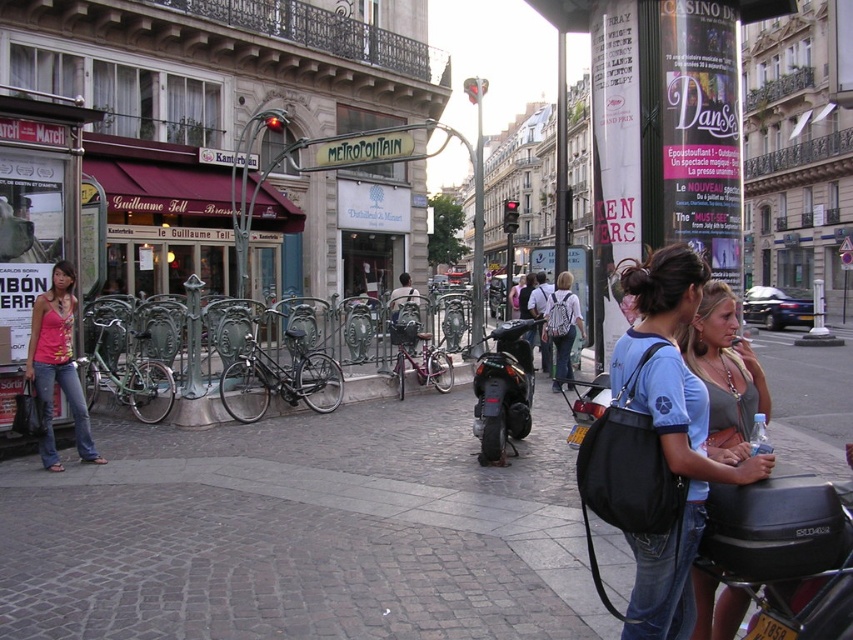
Question: Which is farther from the white backpack at center?

Choices:
 (A) cobblestone pavement at center
 (B) green matte bicycle at left

Answer: (B)

Question: Which is farther from the matte blue shirt at center?

Choices:
 (A) white backpack at center
 (B) denim jeans at lower left
 (C) brushed metal pole at center
 (D) black matte bicycle at center

Answer: (C)

Question: Does cobblestone pavement at center have a greater width compared to matte blue shirt at center?

Choices:
 (A) yes
 (B) no

Answer: (A)

Question: Is denim jeans at lower left to the left of green matte bicycle at left from the viewer's perspective?

Choices:
 (A) no
 (B) yes

Answer: (A)

Question: Does denim jeans at lower left lie in front of metallic pole at center?

Choices:
 (A) yes
 (B) no

Answer: (A)

Question: Which object is closer to the camera taking this photo?

Choices:
 (A) white backpack at center
 (B) matte blue shirt at center

Answer: (B)